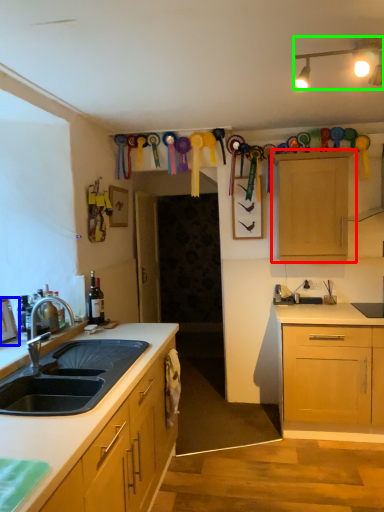
Question: Based on their relative distances, which object is nearer to cabinetry (highlighted by a red box)? Choose from picture frame (highlighted by a blue box) and lamp (highlighted by a green box).

Choices:
 (A) picture frame
 (B) lamp

Answer: (B)